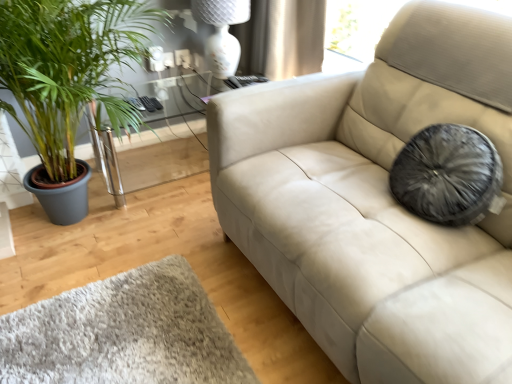
Question: Is clear glass table at left placed right next to green leafy plant at left?

Choices:
 (A) no
 (B) yes

Answer: (A)

Question: From a real-world perspective, does clear glass table at left sit lower than green leafy plant at left?

Choices:
 (A) no
 (B) yes

Answer: (B)

Question: Is clear glass table at left wider than green leafy plant at left?

Choices:
 (A) yes
 (B) no

Answer: (B)

Question: Is clear glass table at left not inside green leafy plant at left?

Choices:
 (A) yes
 (B) no

Answer: (B)

Question: Does clear glass table at left turn towards green leafy plant at left?

Choices:
 (A) no
 (B) yes

Answer: (B)

Question: Considering their positions, is clear glass table at left located in front of or behind green leafy plant at left?

Choices:
 (A) behind
 (B) front

Answer: (A)

Question: Is point (124, 170) positioned closer to the camera than point (2, 39)?

Choices:
 (A) farther
 (B) closer

Answer: (A)

Question: From a real-world perspective, relative to green leafy plant at left, is clear glass table at left vertically above or below?

Choices:
 (A) above
 (B) below

Answer: (B)

Question: Would you say clear glass table at left is to the left or to the right of green leafy plant at left in the picture?

Choices:
 (A) left
 (B) right

Answer: (B)

Question: Is white glossy lamp at upper center taller or shorter than clear glass table at left?

Choices:
 (A) tall
 (B) short

Answer: (A)

Question: Considering the positions of white glossy lamp at upper center and clear glass table at left in the image, is white glossy lamp at upper center bigger or smaller than clear glass table at left?

Choices:
 (A) small
 (B) big

Answer: (A)

Question: From the image's perspective, is white glossy lamp at upper center positioned above or below clear glass table at left?

Choices:
 (A) below
 (B) above

Answer: (B)

Question: Which is correct: white glossy lamp at upper center is inside clear glass table at left, or outside of it?

Choices:
 (A) outside
 (B) inside

Answer: (A)

Question: Is green leafy plant at left in front of or behind clear glass table at left in the image?

Choices:
 (A) front
 (B) behind

Answer: (A)

Question: Choose the correct answer: Is green leafy plant at left inside clear glass table at left or outside it?

Choices:
 (A) outside
 (B) inside

Answer: (A)